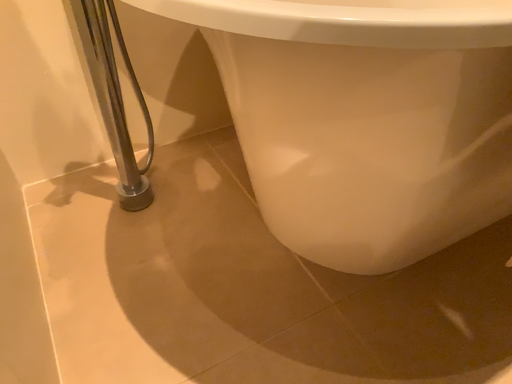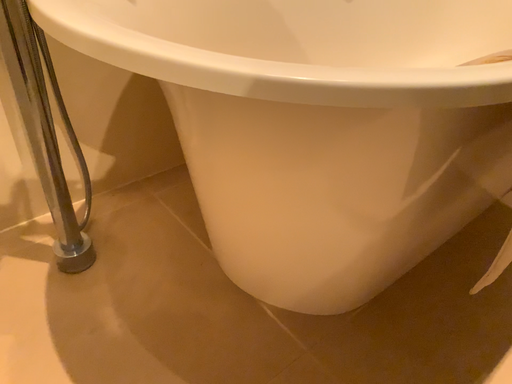
Question: How did the camera likely rotate when shooting the video?

Choices:
 (A) rotated left
 (B) rotated right

Answer: (B)